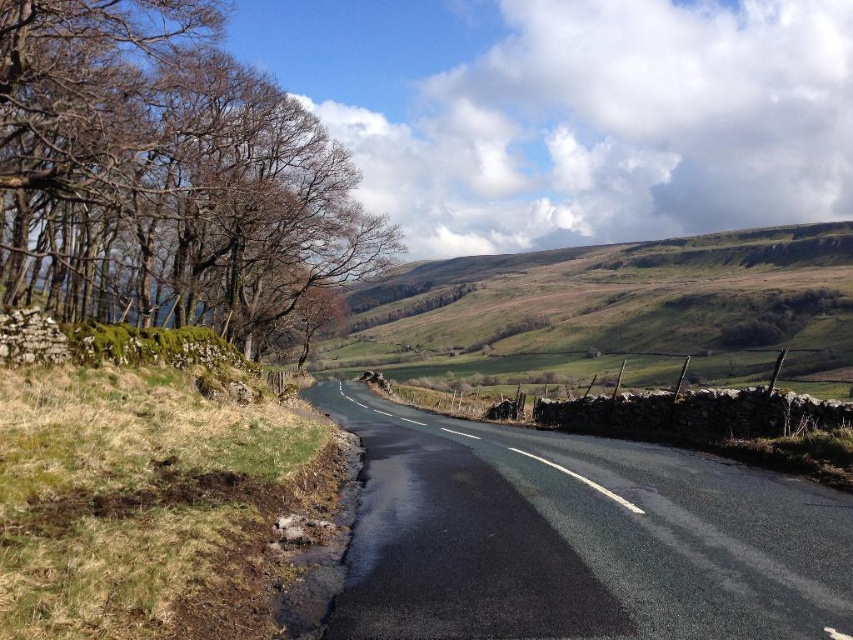
You are standing at the center of the road and want to locate the brown bark tree at left. Which direction should you face to see it?

The brown bark tree at left is located at point [165,173], so you should face to the left side of the road to see it.

You are standing at the starting point of the road in the image. You see two points marked on the road ahead. Which point is closer to you, point (x=381, y=620) or point (x=366, y=307)?

Point (x=381, y=620) is closer to the viewer than point (x=366, y=307).

You are a hiker standing on the road and want to take a photo of both the brown bark tree at left and the green grassy hillside at upper center. Which object should you focus on first to ensure both are in clear view?

You should focus on the brown bark tree at left first because it is closer to you than the green grassy hillside at upper center, ensuring both are in focus as you adjust the camera.